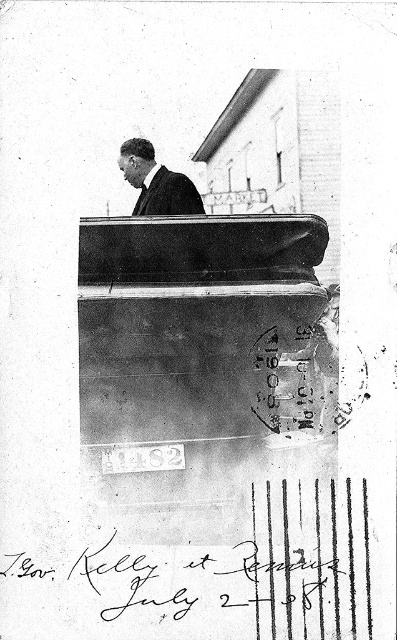
Is dark suit at center smaller than black silk tie at upper center?

No, dark suit at center is not smaller than black silk tie at upper center.

Who is higher up, dark suit at center or black silk tie at upper center?

dark suit at center is above.

Does point (186, 180) lie behind point (142, 209)?

Yes, point (186, 180) is farther from viewer.

Find the location of a particular element. dark suit at center is located at coordinates (156, 182).